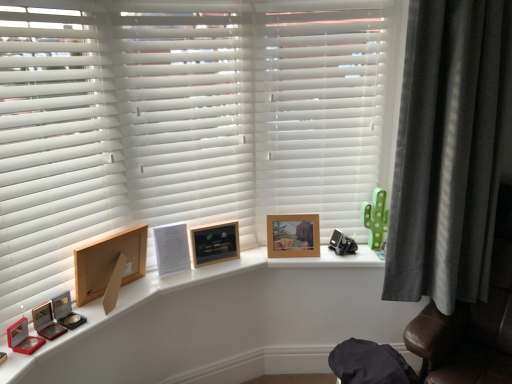
The width and height of the screenshot is (512, 384). Identify the location of vacant space to the left of wooden photo frame at center, the first picture frame positioned from the right. (257, 253).